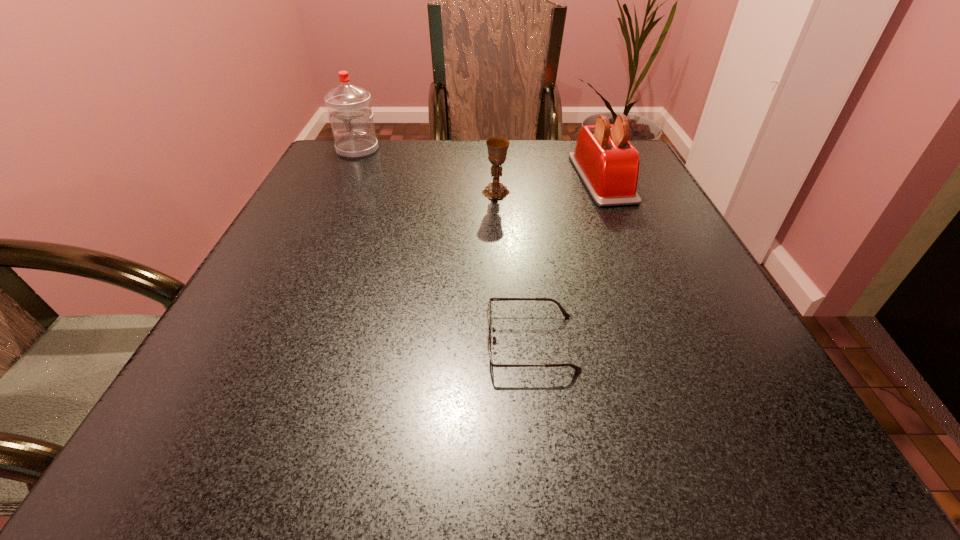
At what (x,y) coordinates should I click in order to perform the action: click on free spot between the nearest object and the third tallest object. Please return your answer as a coordinate pair (x, y). Looking at the image, I should click on (514, 267).

Locate an element on the screen. Image resolution: width=960 pixels, height=540 pixels. vacant area that lies between the shortest object and the toaster is located at coordinates (566, 260).

The image size is (960, 540). I want to click on free space between the chalice and the nearest object, so click(x=514, y=267).

Where is `object that can be found as the second closest to the nearest object`? object that can be found as the second closest to the nearest object is located at coordinates (497, 147).

This screenshot has width=960, height=540. In order to click on object that is the second closest to the shortest object in this screenshot , I will do `click(497, 147)`.

Identify the location of free location that satisfies the following two spatial constraints: 1. on the handle side of the leftmost object; 2. on the right side of the second shortest object. (338, 192).

At what (x,y) coordinates should I click in order to perform the action: click on free spot that satisfies the following two spatial constraints: 1. on the handle side of the chalice; 2. on the left side of the tallest object. Please return your answer as a coordinate pair (x, y). Image resolution: width=960 pixels, height=540 pixels. Looking at the image, I should click on (338, 192).

Where is `vacant area that satisfies the following two spatial constraints: 1. on the handle side of the tallest object; 2. on the left side of the second tallest object`? vacant area that satisfies the following two spatial constraints: 1. on the handle side of the tallest object; 2. on the left side of the second tallest object is located at coordinates (345, 178).

Where is `free space in the image that satisfies the following two spatial constraints: 1. on the handle side of the water bottle; 2. on the left side of the third shortest object`? This screenshot has width=960, height=540. free space in the image that satisfies the following two spatial constraints: 1. on the handle side of the water bottle; 2. on the left side of the third shortest object is located at coordinates (345, 178).

Image resolution: width=960 pixels, height=540 pixels. Find the location of `blank area in the image that satisfies the following two spatial constraints: 1. on the handle side of the third tallest object; 2. on the right side of the leftmost object`. blank area in the image that satisfies the following two spatial constraints: 1. on the handle side of the third tallest object; 2. on the right side of the leftmost object is located at coordinates (338, 192).